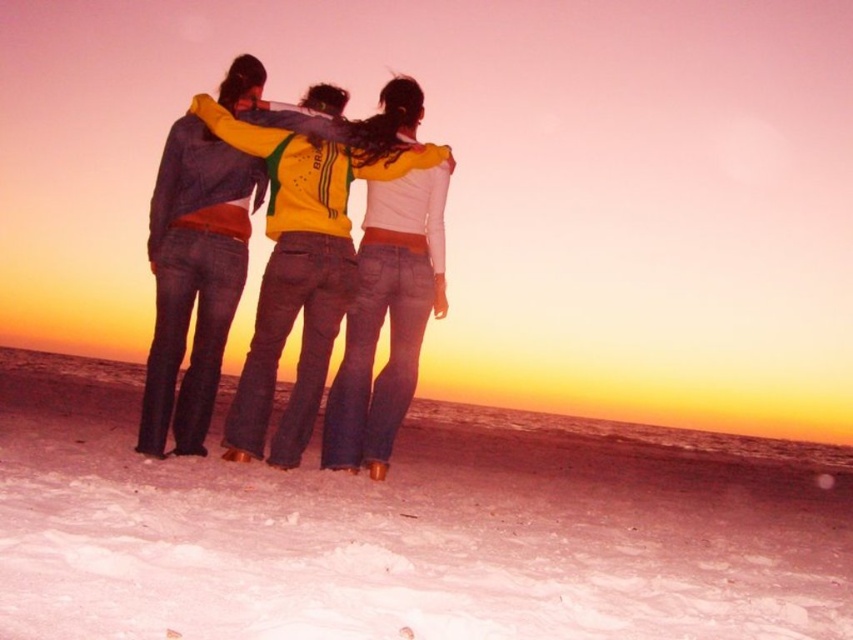
Question: Which point appears closest to the camera in this image?

Choices:
 (A) (47, 560)
 (B) (334, 403)
 (C) (289, 438)

Answer: (A)

Question: Which of the following is the farthest from the observer?

Choices:
 (A) yellow-green jersey at center
 (B) white powdery snow at center
 (C) denim jacket at center

Answer: (A)

Question: Which point appears closest to the camera in this image?

Choices:
 (A) (380, 316)
 (B) (100, 472)

Answer: (B)

Question: Does denim jacket at center have a smaller size compared to yellow-green jersey at center?

Choices:
 (A) no
 (B) yes

Answer: (A)

Question: Is denim jacket at center to the right of yellow-green jersey at center from the viewer's perspective?

Choices:
 (A) yes
 (B) no

Answer: (B)

Question: From the image, what is the correct spatial relationship of white powdery snow at center in relation to yellow-green jersey at center?

Choices:
 (A) left
 (B) right

Answer: (A)